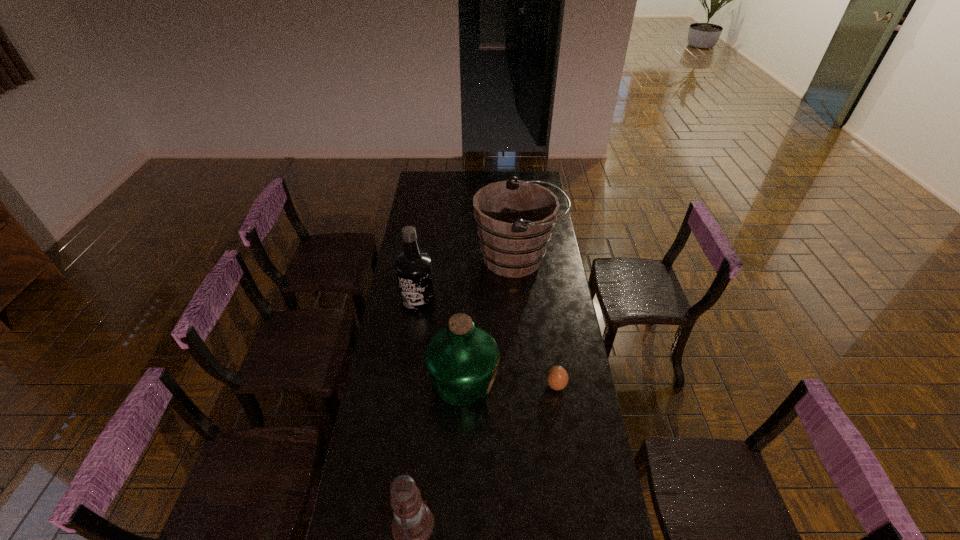
In order to click on boiled egg that is at the right edge in this screenshot , I will do 557,378.

Identify the location of vacant space at the far edge of the desktop. The image size is (960, 540). (502, 177).

Where is `vacant space at the left edge of the desktop`? vacant space at the left edge of the desktop is located at coordinates (412, 411).

The image size is (960, 540). I want to click on vacant space at the right edge of the desktop, so click(566, 287).

The height and width of the screenshot is (540, 960). In order to click on vacant space at the far right corner of the desktop in this screenshot , I will do pyautogui.click(x=541, y=176).

Locate an element on the screen. The height and width of the screenshot is (540, 960). free space between the farther liquor and the bucket is located at coordinates (468, 280).

I want to click on vacant point located between the nearer liquor and the farthest object, so click(491, 320).

The width and height of the screenshot is (960, 540). I want to click on blank region between the farther liquor and the farthest object, so click(x=468, y=280).

Where is `vacant point located between the boiled egg and the shorter liquor`? vacant point located between the boiled egg and the shorter liquor is located at coordinates (510, 383).

The width and height of the screenshot is (960, 540). What are the coordinates of `object that stands as the closest to the bucket` in the screenshot? It's located at (413, 267).